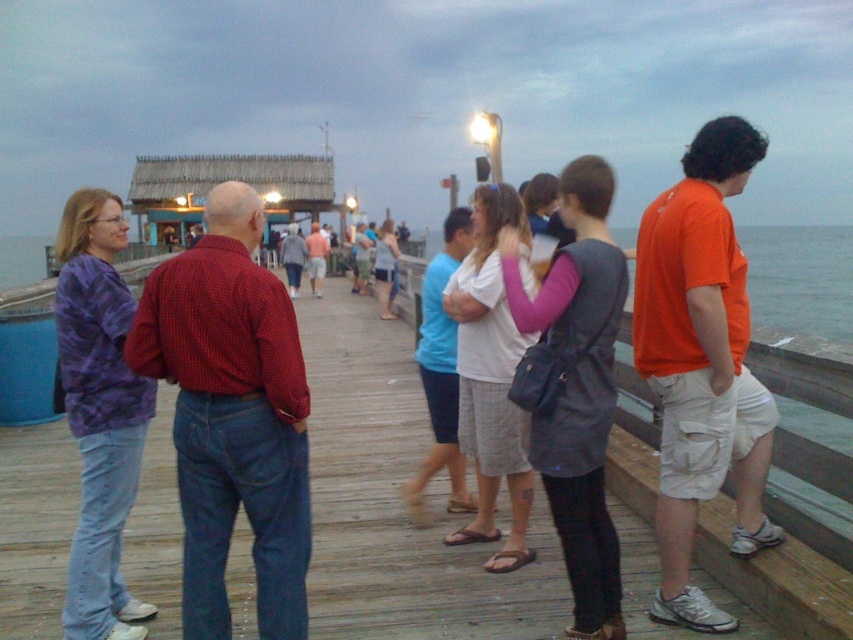
Question: Can you confirm if wooden dock at center is positioned below dark gray fabric vest at center?

Choices:
 (A) yes
 (B) no

Answer: (B)

Question: From the image, what is the correct spatial relationship of dark gray fabric vest at center in relation to matte blue shirt at center?

Choices:
 (A) above
 (B) below

Answer: (B)

Question: Does orange cotton shirt at right come in front of purple tie-dye sweater at left?

Choices:
 (A) no
 (B) yes

Answer: (A)

Question: Among these objects, which one is nearest to the camera?

Choices:
 (A) red checkered shirt at center
 (B) wooden dock at center
 (C) orange cotton shirt at right

Answer: (A)

Question: Estimate the real-world distances between objects in this image. Which object is farther from the dark gray fabric vest at center?

Choices:
 (A) purple tie-dye sweater at left
 (B) orange fabric shorts at right
 (C) orange cotton shirt at right
 (D) white cotton shirt at center

Answer: (B)

Question: Which point appears farthest from the camera in this image?

Choices:
 (A) (250, 314)
 (B) (843, 532)
 (C) (543, 584)

Answer: (C)